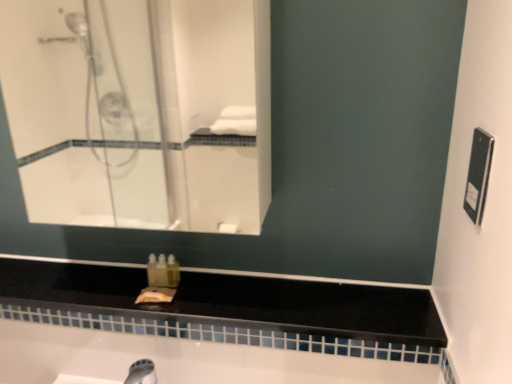
The width and height of the screenshot is (512, 384). Describe the element at coordinates (140, 111) in the screenshot. I see `white glass mirror at upper left` at that location.

Find the location of a particular element. This screenshot has height=384, width=512. white glass mirror at upper left is located at coordinates (140, 111).

What is the approximate width of black matte counter top at center?

8.12 inches.

This screenshot has width=512, height=384. Describe the element at coordinates (230, 302) in the screenshot. I see `black matte counter top at center` at that location.

Identify the location of black matte counter top at center. The width and height of the screenshot is (512, 384). (230, 302).

Find the location of `white glass mirror at upper left`. white glass mirror at upper left is located at coordinates (140, 111).

Is black matte counter top at center at the right side of white glass mirror at upper left?

Yes, black matte counter top at center is to the right of white glass mirror at upper left.

Is black matte counter top at center closer to the viewer compared to white glass mirror at upper left?

No, black matte counter top at center is further to the viewer.

Does point (168, 329) come behind point (130, 55)?

That is False.

From the image's perspective, does black matte counter top at center appear lower than white glass mirror at upper left?

Correct, black matte counter top at center appears lower than white glass mirror at upper left in the image.

From a real-world perspective, is black matte counter top at center on top of white glass mirror at upper left?

No, from a real-world perspective, black matte counter top at center is not over white glass mirror at upper left

Is black matte counter top at center wider or thinner than white glass mirror at upper left?

Considering their sizes, black matte counter top at center looks broader than white glass mirror at upper left.

Who is taller, black matte counter top at center or white glass mirror at upper left?

Standing taller between the two is white glass mirror at upper left.

Can you confirm if black matte counter top at center is bigger than white glass mirror at upper left?

Actually, black matte counter top at center might be smaller than white glass mirror at upper left.

Choose the correct answer: Is black matte counter top at center inside white glass mirror at upper left or outside it?

black matte counter top at center is not enclosed by white glass mirror at upper left.

Is black matte counter top at center not near white glass mirror at upper left?

black matte counter top at center is far away from white glass mirror at upper left.

Could you tell me if black matte counter top at center is turned towards white glass mirror at upper left?

No, black matte counter top at center does not turn towards white glass mirror at upper left.

Measure the distance between black matte counter top at center and white glass mirror at upper left.

A distance of 1.73 meters exists between black matte counter top at center and white glass mirror at upper left.

Find the location of `mirror above the black matte counter top at center (from the image's perspective)`. mirror above the black matte counter top at center (from the image's perspective) is located at coordinates click(x=140, y=111).

Considering the positions of objects white glass mirror at upper left and black matte counter top at center in the image provided, who is more to the right, white glass mirror at upper left or black matte counter top at center?

black matte counter top at center is more to the right.

Is white glass mirror at upper left behind black matte counter top at center?

No, it is not.

Does point (255, 216) come behind point (391, 327)?

Yes, point (255, 216) is behind point (391, 327).

From the image's perspective, who appears lower, white glass mirror at upper left or black matte counter top at center?

From the image's view, black matte counter top at center is below.

From a real-world perspective, is white glass mirror at upper left physically located above or below black matte counter top at center?

white glass mirror at upper left is situated higher than black matte counter top at center in the real world.

Considering the relative sizes of white glass mirror at upper left and black matte counter top at center in the image provided, is white glass mirror at upper left thinner than black matte counter top at center?

Correct, the width of white glass mirror at upper left is less than that of black matte counter top at center.

Who is shorter, white glass mirror at upper left or black matte counter top at center?

Standing shorter between the two is black matte counter top at center.

Can you confirm if white glass mirror at upper left is smaller than black matte counter top at center?

No.

Is white glass mirror at upper left spatially inside black matte counter top at center, or outside of it?

The correct answer is: outside.

Is white glass mirror at upper left far away from black matte counter top at center?

Yes, white glass mirror at upper left and black matte counter top at center are located far from each other.

Is white glass mirror at upper left looking in the opposite direction of black matte counter top at center?

No, white glass mirror at upper left's orientation is not away from black matte counter top at center.

The height and width of the screenshot is (384, 512). What are the coordinates of `counter top located behind the white glass mirror at upper left` in the screenshot? It's located at (230, 302).

The image size is (512, 384). In order to click on mirror above the black matte counter top at center (from a real-world perspective) in this screenshot , I will do `click(140, 111)`.

Locate an element on the screen. The height and width of the screenshot is (384, 512). counter top on the right of the white glass mirror at upper left is located at coordinates (230, 302).